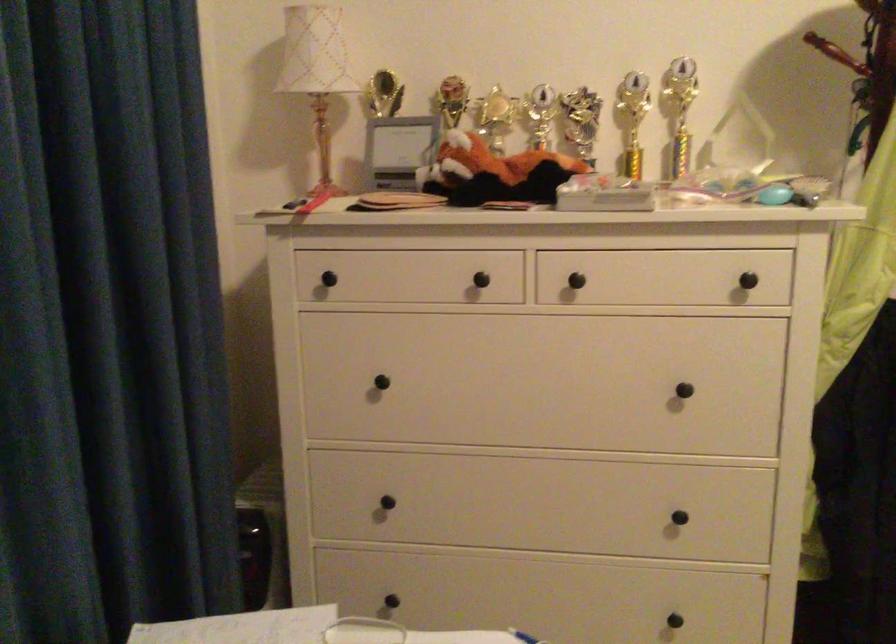
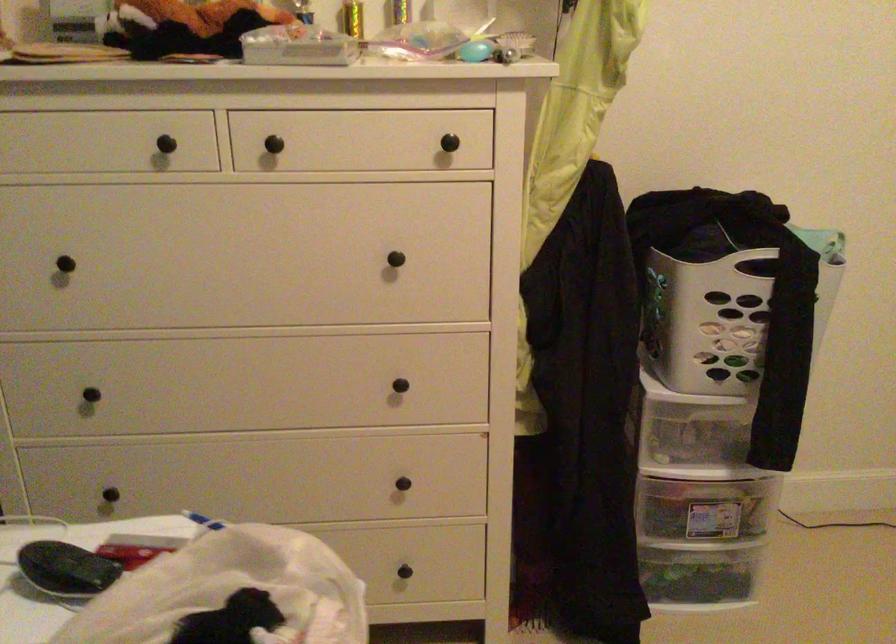
Question: The images are taken continuously from a first-person perspective. In which direction are you moving?

Choices:
 (A) Left
 (B) Right
 (C) Forward
 (D) Backward

Answer: (B)